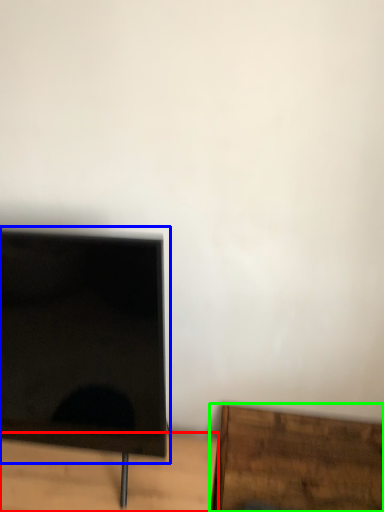
Question: Which is farther away from table (highlighted by a red box)? computer monitor (highlighted by a blue box) or furniture (highlighted by a green box)?

Choices:
 (A) computer monitor
 (B) furniture

Answer: (B)